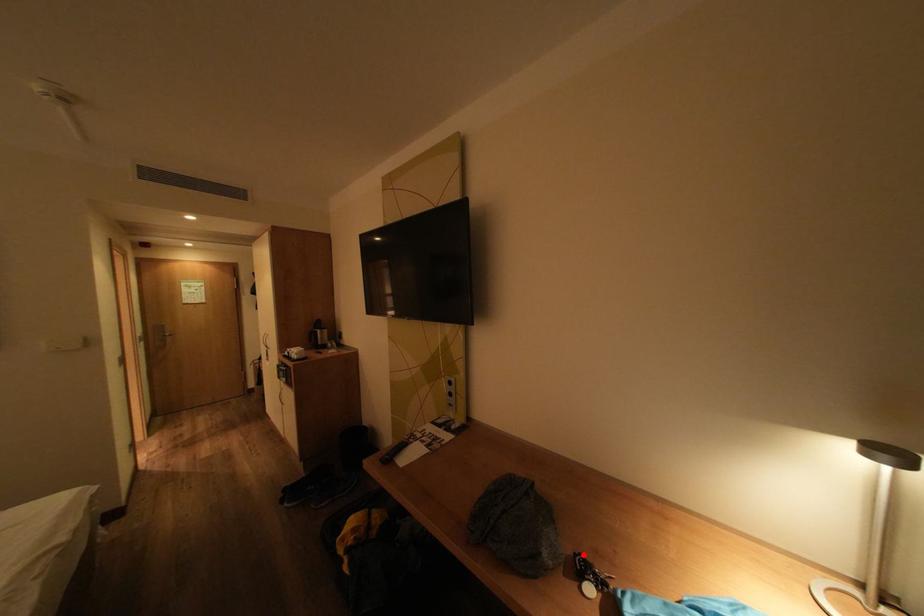
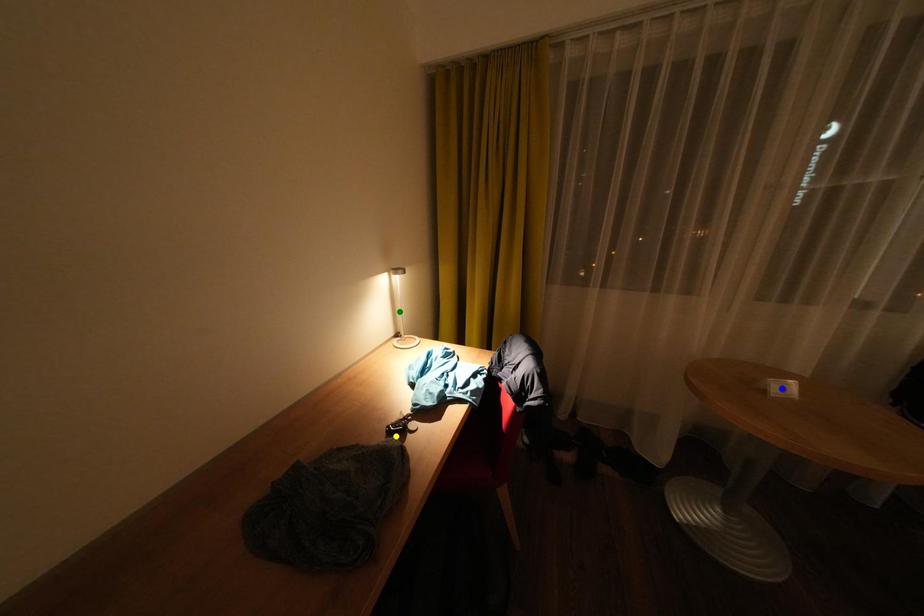
Question: I am providing you with two images of the same scene from different viewpoints. A red point is marked on the first image. You are given multiple points on the second image. Which mark in image 2 goes with the point in image 1?

Choices:
 (A) blue point
 (B) yellow point
 (C) green point

Answer: (B)